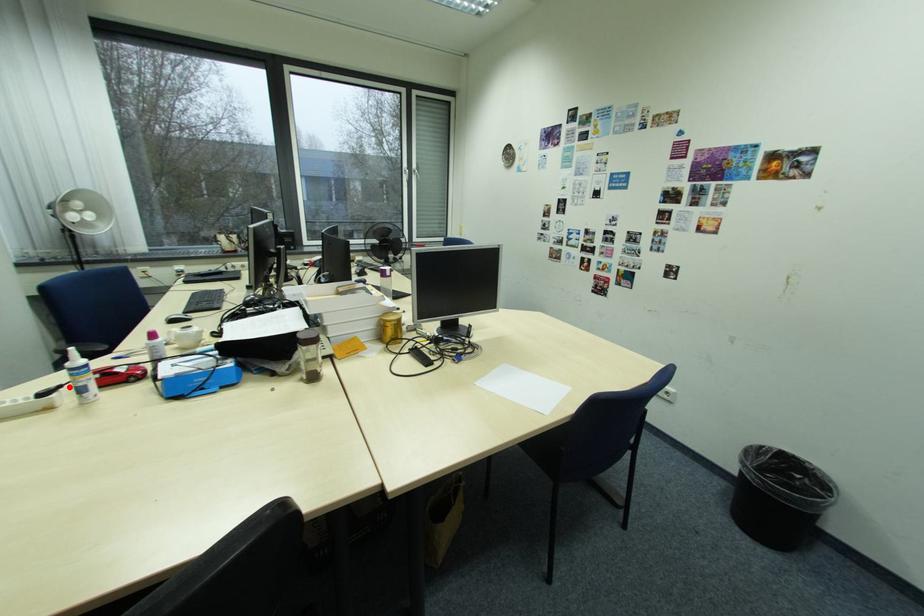
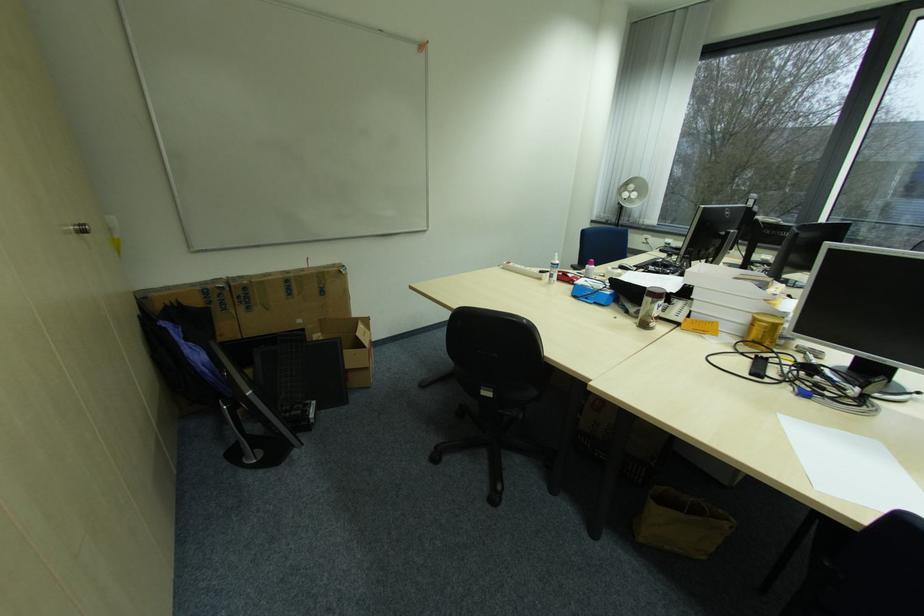
Locate, in the second image, the point that corresponds to the highlighted location in the first image.

(555, 273)